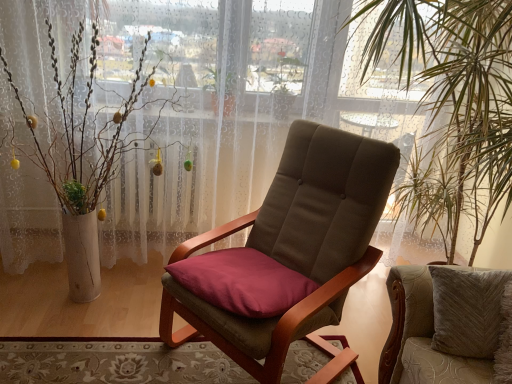
The image size is (512, 384). I want to click on vacant area that is in front of white textured vase at left, so click(82, 352).